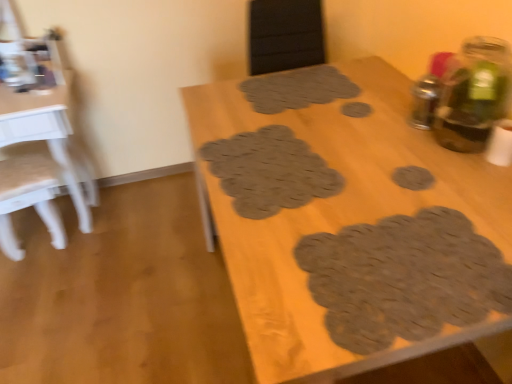
Question: Which direction should I rotate to look at brown textured mat at center, the third footprint ordered from the bottom, — up or down?

Choices:
 (A) up
 (B) down

Answer: (A)

Question: Does brown textured mat at center, positioned as the 3th footprint in top-to-bottom order, have a greater height compared to white glossy table at left, marked as the first table in a left-to-right arrangement?

Choices:
 (A) no
 (B) yes

Answer: (A)

Question: Is brown textured mat at center, which appears as the 4th footprint when viewed from the back, oriented away from white glossy table at left, marked as the first table in a left-to-right arrangement?

Choices:
 (A) no
 (B) yes

Answer: (A)

Question: Is there a large distance between brown textured mat at center, arranged as the second footprint when viewed from the front, and white glossy table at left, which is the second table in right-to-left order?

Choices:
 (A) no
 (B) yes

Answer: (B)

Question: Does brown textured mat at center, arranged as the second footprint when viewed from the front, have a lesser height compared to white glossy table at left, marked as the first table in a left-to-right arrangement?

Choices:
 (A) no
 (B) yes

Answer: (B)

Question: Is brown textured mat at center, positioned as the 3th footprint in top-to-bottom order, thinner than white glossy table at left, marked as the first table in a left-to-right arrangement?

Choices:
 (A) yes
 (B) no

Answer: (A)

Question: Considering the relative sizes of brown textured mat at center, positioned as the 3th footprint in top-to-bottom order, and white glossy table at left, which is the second table in right-to-left order, in the image provided, is brown textured mat at center, positioned as the 3th footprint in top-to-bottom order, wider than white glossy table at left, which is the second table in right-to-left order,?

Choices:
 (A) no
 (B) yes

Answer: (A)

Question: From the image's perspective, does brown textured mat at center, arranged as the second footprint when viewed from the front, appear higher than brown textured mat at bottom right, which is the fifth footprint from back to front?

Choices:
 (A) no
 (B) yes

Answer: (B)

Question: Can you confirm if brown textured mat at center, the third footprint ordered from the bottom, is wider than brown textured mat at bottom right, which is the fifth footprint from back to front?

Choices:
 (A) no
 (B) yes

Answer: (A)

Question: Is brown textured mat at center, arranged as the second footprint when viewed from the front, not close to brown textured mat at bottom right, arranged as the first footprint when ordered from the bottom?

Choices:
 (A) no
 (B) yes

Answer: (A)

Question: From the image's perspective, is brown textured mat at center, which appears as the 4th footprint when viewed from the back, beneath brown textured mat at bottom right, arranged as the first footprint when ordered from the bottom?

Choices:
 (A) yes
 (B) no

Answer: (B)

Question: Are brown textured mat at center, arranged as the second footprint when viewed from the front, and brown textured mat at bottom right, arranged as the first footprint when ordered from the bottom, making contact?

Choices:
 (A) no
 (B) yes

Answer: (A)

Question: Is the depth of brown textured mat at center, which appears as the 4th footprint when viewed from the back, less than that of brown textured mat at bottom right, marked as the fifth footprint in a top-to-bottom arrangement?

Choices:
 (A) yes
 (B) no

Answer: (B)

Question: Could you tell me if brown textured mat at bottom right, which is the fifth footprint from back to front, is turned towards brown textured placemats at center, which is the 1th table from right to left?

Choices:
 (A) yes
 (B) no

Answer: (A)